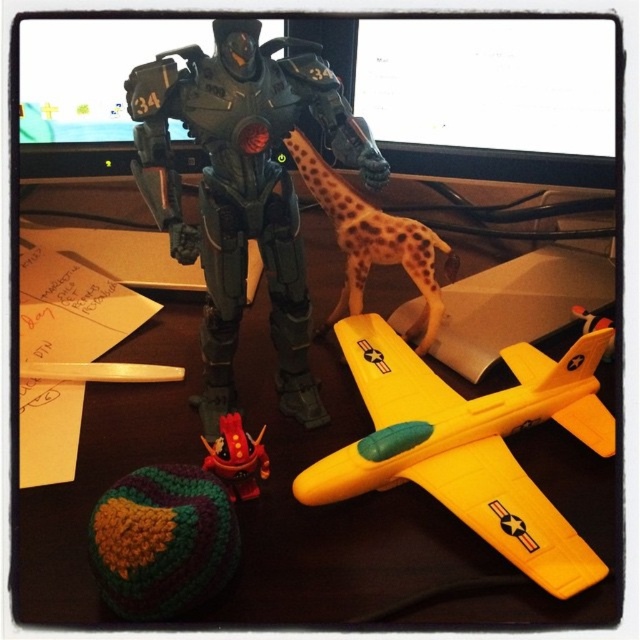
Does rubberized red robot at lower center have a lesser height compared to black plastic table at center?

Indeed, rubberized red robot at lower center has a lesser height compared to black plastic table at center.

Between rubberized red robot at lower center and black plastic table at center, which one has less height?

Standing shorter between the two is rubberized red robot at lower center.

Who is more distant from viewer, (205, 452) or (244, 365)?

Point (244, 365)

Find the location of a particular element. rubberized red robot at lower center is located at coordinates (236, 458).

Does point (144, 528) come in front of point (406, 556)?

That is True.

Is point (140, 520) positioned before point (317, 244)?

Yes.

The image size is (640, 640). Identify the location of multicolored knitted ball at lower left. (163, 541).

Measure the distance between point (401, 221) and camera.

They are 39.00 inches apart.

Which is above, spotted brown spotted toy at center or black plastic table at center?

spotted brown spotted toy at center is above.

Describe the element at coordinates (372, 243) in the screenshot. This screenshot has width=640, height=640. I see `spotted brown spotted toy at center` at that location.

I want to click on spotted brown spotted toy at center, so click(372, 243).